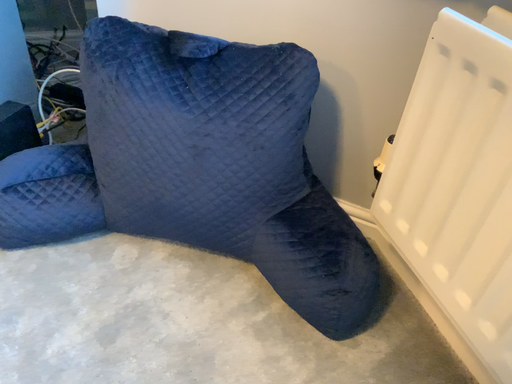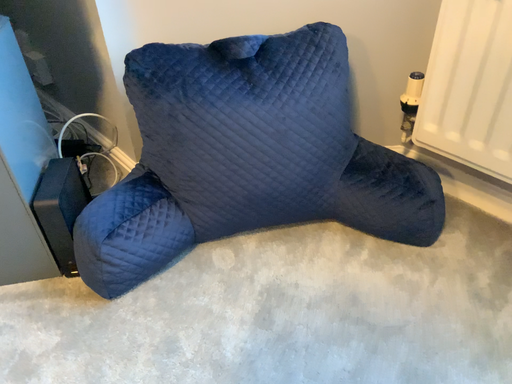
Question: Which way did the camera rotate in the video?

Choices:
 (A) rotated left
 (B) rotated right

Answer: (B)